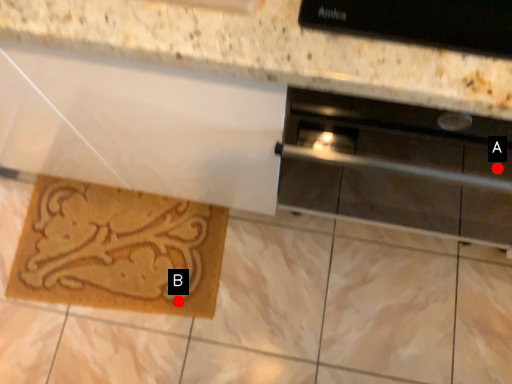
Question: Two points are circled on the image, labeled by A and B beside each circle. Among these points, which one is farthest from the camera?

Choices:
 (A) A is further
 (B) B is further

Answer: (B)